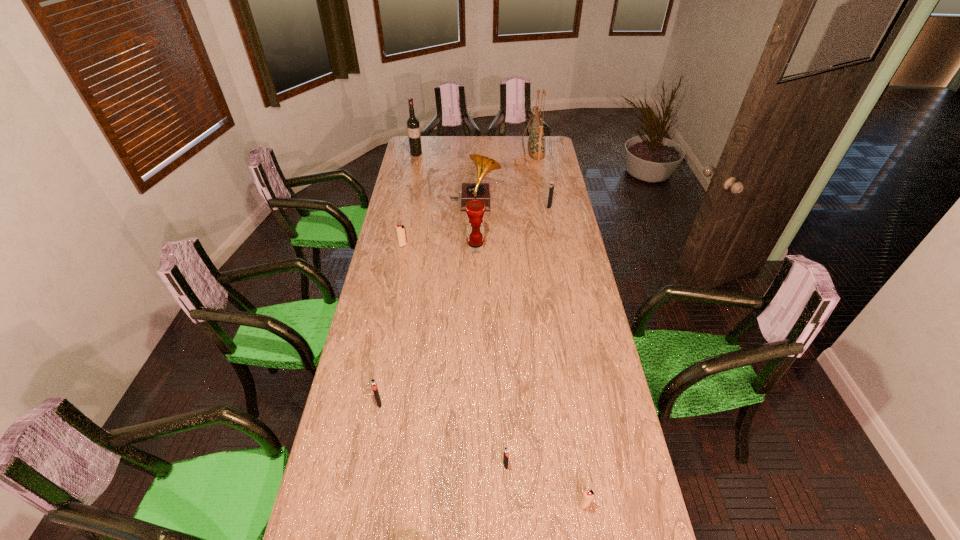
Locate an element on the screen. Image resolution: width=960 pixels, height=540 pixels. handbag is located at coordinates (536, 143).

In order to click on wine bottle in this screenshot , I will do `click(413, 127)`.

What are the coordinates of `the third tallest object` in the screenshot? It's located at (470, 191).

Find the location of `brown phonograph record`. brown phonograph record is located at coordinates [470, 191].

Locate an element on the screen. Image resolution: width=960 pixels, height=540 pixels. red condiment is located at coordinates (475, 210).

The width and height of the screenshot is (960, 540). Find the location of `condiment`. condiment is located at coordinates (475, 210).

The width and height of the screenshot is (960, 540). I want to click on the tallest igniter, so click(551, 189).

The height and width of the screenshot is (540, 960). Identify the location of the fifth tallest object. (551, 189).

Image resolution: width=960 pixels, height=540 pixels. I want to click on the second nearest black igniter, so click(374, 386).

Find the location of a particular element. the third nearest igniter is located at coordinates (374, 386).